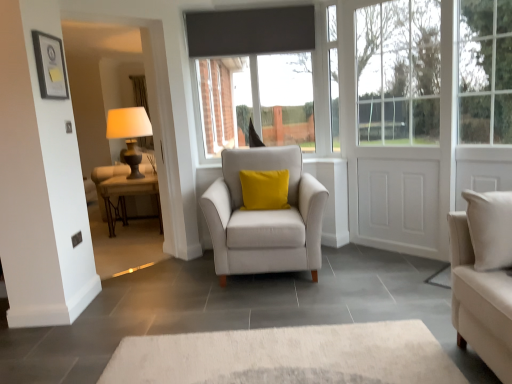
The image size is (512, 384). What do you see at coordinates (264, 217) in the screenshot?
I see `light gray fabric armchair at center` at bounding box center [264, 217].

Measure the distance between point [332,53] and camera.

Point [332,53] is 12.30 feet from camera.

You are a GUI agent. You are given a task and a screenshot of the screen. Output one action in this format:
    pyautogui.click(x=<x>, y=<y>)
    Task: Click on the white plastic window frame at upper right
    The width and height of the screenshot is (512, 384).
    Given the screenshot: What is the action you would take?
    pyautogui.click(x=333, y=75)

Measure the distance between point (393, 61) and camera.

The depth of point (393, 61) is 3.36 meters.

Where is `matte black table at left`? Image resolution: width=512 pixels, height=384 pixels. matte black table at left is located at coordinates (125, 193).

Who is shorter, white plastic window frame at upper right or matte black table lamp at left?

matte black table lamp at left.

Between point (335, 110) and point (124, 124), which one is positioned in front?

The point (335, 110) is more forward.

Is white plastic window frame at upper right in front of or behind matte black table lamp at left in the image?

Clearly, white plastic window frame at upper right is in front of matte black table lamp at left.

From the picture: Looking at the image, does white plastic window frame at upper right seem bigger or smaller compared to matte black table lamp at left?

In the image, white plastic window frame at upper right appears to be smaller than matte black table lamp at left.

From the image's perspective, would you say matte black table at left is positioned over white matte door at right?

Actually, matte black table at left appears below white matte door at right in the image.

Would you say matte black table at left is to the left or to the right of white matte door at right in the picture?

In the image, matte black table at left appears on the left side of white matte door at right.

Can you confirm if matte black table at left is thinner than white matte door at right?

Incorrect, the width of matte black table at left is not less than that of white matte door at right.

From a real-world perspective, which object stands above the other?

In real-world perspective, white matte door at right is above.

From the image's perspective, which one is positioned lower, matte black picture frame at upper left or white matte door at right?

white matte door at right, from the image's perspective.

Which point is more distant from viewer, (57,48) or (356,69)?

Point (356,69)

Find the location of a particular element. picture frame that is on the left side of white matte door at right is located at coordinates [50, 66].

In the scene shown: In terms of height, does matte black table at left look taller or shorter compared to matte black table lamp at left?

In the image, matte black table at left appears to be shorter than matte black table lamp at left.

Does matte black table at left lie in front of matte black table lamp at left?

No.

You are a GUI agent. You are given a task and a screenshot of the screen. Output one action in this format:
    pyautogui.click(x=<x>, y=<y>)
    Task: Click on the table lamp lying in front of the matte black table at left
    Image resolution: width=512 pixels, height=384 pixels.
    Given the screenshot: What is the action you would take?
    pyautogui.click(x=129, y=133)

Considering the positions of point (122, 214) and point (136, 111), is point (122, 214) closer or farther from the camera than point (136, 111)?

Point (122, 214) appears to be farther away from the viewer than point (136, 111).

Can you confirm if white matte door at right is thinner than matte black table lamp at left?

Yes.

From a real-world perspective, is white matte door at right over matte black table lamp at left?

Yes, from a real-world perspective, white matte door at right is over matte black table lamp at left

Considering the sizes of white matte door at right and matte black table lamp at left in the image, is white matte door at right taller or shorter than matte black table lamp at left?

Considering their sizes, white matte door at right has more height than matte black table lamp at left.

Is white matte door at right far away from matte black table lamp at left?

Yes.

Measure the distance between white plastic window frame at upper right and matte black table at left.

white plastic window frame at upper right is 7.28 feet away from matte black table at left.

From a real-world perspective, is white plastic window frame at upper right positioned under matte black table at left based on gravity?

No, from a real-world perspective, white plastic window frame at upper right is not below matte black table at left.

In the image, there is a white plastic window frame at upper right. In order to click on table below it (from a real-world perspective) in this screenshot , I will do `click(125, 193)`.

From the image's perspective, is white plastic window frame at upper right under matte black table at left?

Incorrect, from the image's perspective, white plastic window frame at upper right is higher than matte black table at left.

From a real-world perspective, is matte black picture frame at upper left beneath matte black table at left?

Actually, matte black picture frame at upper left is physically above matte black table at left in the real world.

Is matte black picture frame at upper left aimed at matte black table at left?

No, matte black picture frame at upper left does not turn towards matte black table at left.

The image size is (512, 384). In order to click on picture frame positioned vertically above the matte black table at left (from a real-world perspective) in this screenshot , I will do `click(50, 66)`.

Where is `window frame that is above the matte black table lamp at left (from the image's perspective)`? window frame that is above the matte black table lamp at left (from the image's perspective) is located at coordinates (333, 75).

You are a GUI agent. You are given a task and a screenshot of the screen. Output one action in this format:
    pyautogui.click(x=<x>, y=<y>)
    Task: Click on the door on the right side of matte black table at left
    This screenshot has width=512, height=384.
    Given the screenshot: What is the action you would take?
    pyautogui.click(x=399, y=128)

When comparing their distances from matte black table at left, does matte black table lamp at left or matte black picture frame at upper left seem closer?

matte black table lamp at left is closer to matte black table at left.

Estimate the real-world distances between objects in this image. Which object is closer to matte black table at left, white matte door at right or matte black picture frame at upper left?

Based on the image, matte black picture frame at upper left appears to be nearer to matte black table at left.

From the image, which object appears to be nearer to light gray fabric armchair at center, matte black table at left or matte black table lamp at left?

matte black table at left is closer to light gray fabric armchair at center.

Which object lies nearer to the anchor point light gray fabric armchair at center, matte black table lamp at left or matte black picture frame at upper left?

Based on the image, matte black picture frame at upper left appears to be nearer to light gray fabric armchair at center.

Consider the image. From the image, which object appears to be nearer to white matte door at right, matte black table lamp at left or light gray fabric armchair at center?

light gray fabric armchair at center lies closer to white matte door at right than the other object.

Considering their positions, is light gray fabric armchair at center positioned closer to matte black table lamp at left than matte black table at left?

matte black table at left is closer to matte black table lamp at left.

Estimate the real-world distances between objects in this image. Which object is further from white matte door at right, matte black table lamp at left or white plastic window frame at upper right?

matte black table lamp at left is further to white matte door at right.

Looking at the image, which one is located closer to matte black picture frame at upper left, matte black table lamp at left or white plastic window frame at upper right?

Among the two, matte black table lamp at left is located nearer to matte black picture frame at upper left.

Find the location of a particular element. This screenshot has width=512, height=384. table lamp between light gray fabric armchair at center and matte black table at left along the z-axis is located at coordinates (129, 133).

Where is `door between white plastic window frame at upper right and light gray fabric armchair at center from top to bottom`? This screenshot has width=512, height=384. door between white plastic window frame at upper right and light gray fabric armchair at center from top to bottom is located at coordinates (399, 128).

The height and width of the screenshot is (384, 512). Identify the location of chair located between matte black table at left and white plastic window frame at upper right in the left-right direction. (264, 217).

This screenshot has width=512, height=384. I want to click on chair between matte black table lamp at left and white plastic window frame at upper right from left to right, so click(x=264, y=217).